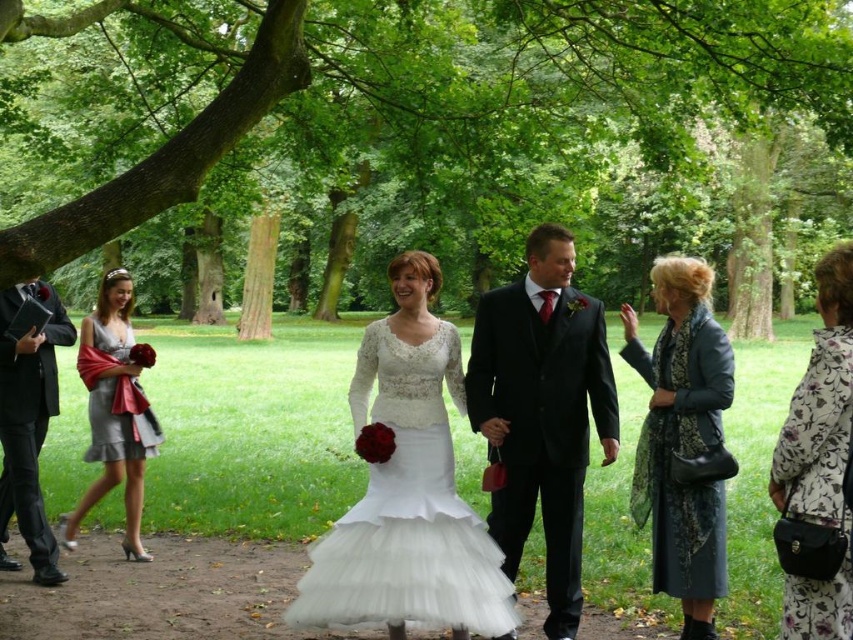
Can you confirm if shiny black suit at center is smaller than silver satin dress at left?

No, shiny black suit at center is not smaller than silver satin dress at left.

This screenshot has height=640, width=853. I want to click on shiny black suit at center, so click(x=543, y=412).

Where is `shiny black suit at center`? This screenshot has height=640, width=853. shiny black suit at center is located at coordinates (543, 412).

Between floral-patterned fabric dress at lower right and satin silver dress at left, which one is positioned lower?

satin silver dress at left is lower down.

Is point (817, 605) closer to camera compared to point (74, 529)?

Yes, point (817, 605) is in front of point (74, 529).

Locate an element on the screen. The height and width of the screenshot is (640, 853). floral-patterned fabric dress at lower right is located at coordinates (816, 435).

Does green leafy tree at upper center have a smaller size compared to leather jacket at right?

Actually, green leafy tree at upper center might be larger than leather jacket at right.

Is green leafy tree at upper center further to the viewer compared to leather jacket at right?

Yes, it is behind leather jacket at right.

Does point (782, 268) come farther from viewer compared to point (640, 362)?

Yes, point (782, 268) is farther from viewer.

Where is `green leafy tree at upper center`? green leafy tree at upper center is located at coordinates (426, 141).